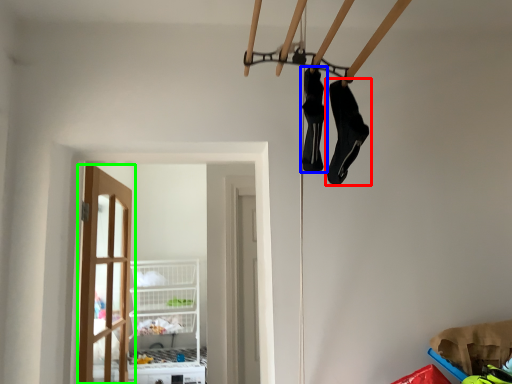
Question: Which object is positioned closest to footwear (highlighted by a red box)? Select from footwear (highlighted by a blue box) and door (highlighted by a green box).

Choices:
 (A) footwear
 (B) door

Answer: (A)